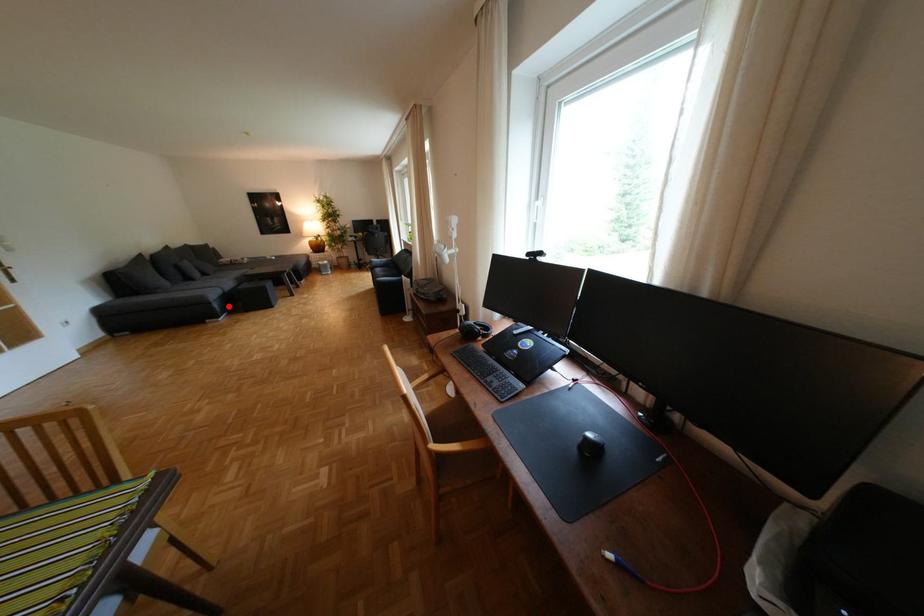
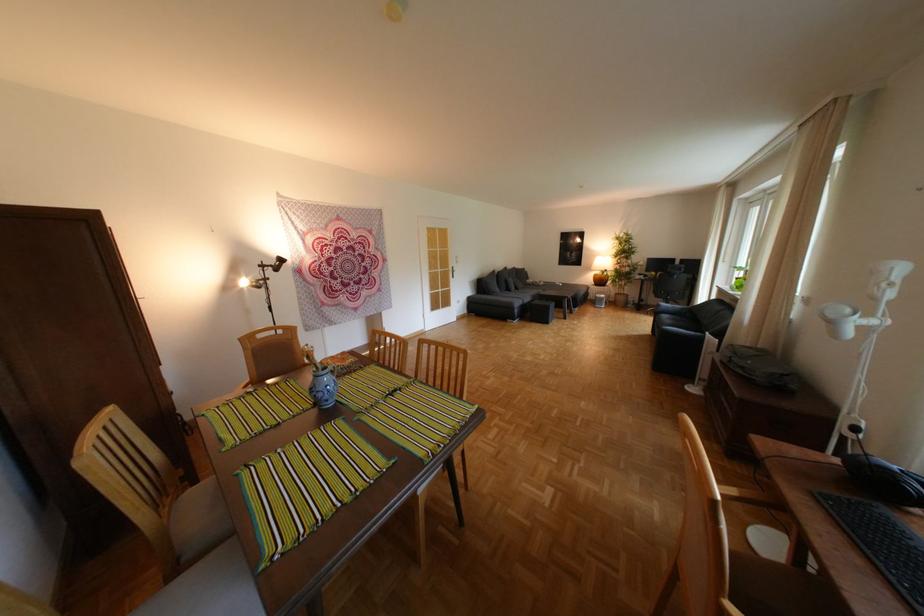
Question: I am providing you with two images of the same scene from different viewpoints. Image1 has a red point marked. In image2, the corresponding 3D location appears at what relative position? Reply with the corresponding letter.

Choices:
 (A) Closer
 (B) Farther

Answer: (B)